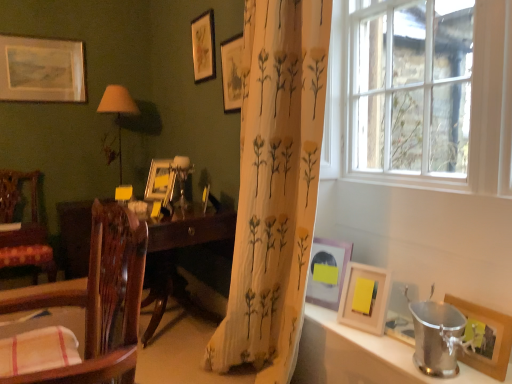
Describe the element at coordinates (360, 356) in the screenshot. Image resolution: width=512 pixels, height=384 pixels. I see `silver metallic bucket at lower right` at that location.

This screenshot has height=384, width=512. Describe the element at coordinates (176, 253) in the screenshot. I see `wooden desk at center` at that location.

This screenshot has height=384, width=512. What are the coordinates of `matte gold picture frame at center, arranged as the 6th picture frame when viewed from the right` in the screenshot? It's located at (160, 181).

You are a GUI agent. You are given a task and a screenshot of the screen. Output one action in this format:
    pyautogui.click(x=<x>, y=<y>)
    Task: Click on the matte gold picture frame at upper center, the 5th picture frame from the front
    This screenshot has width=512, height=384.
    Given the screenshot: What is the action you would take?
    pyautogui.click(x=203, y=47)

In order to face wooden chair at left, acting as the 2th chair starting from the left, should I rotate leftwards or rightwards?

To face it directly, rotate left by 24.334 degrees.

Image resolution: width=512 pixels, height=384 pixels. Identify the location of wooden chair with floral upholstery at left, positioned as the 1th chair in back-to-front order. (24, 227).

In terms of size, does matte wooden picture frame at upper center, the fourth picture frame viewed from the left, appear bigger or smaller than pink matte picture frame at lower right, the 3th picture frame in the right-to-left sequence?

Clearly, matte wooden picture frame at upper center, the fourth picture frame viewed from the left, is larger in size than pink matte picture frame at lower right, the 3th picture frame in the right-to-left sequence.

In the scene shown: Between matte wooden picture frame at upper center, the fourth picture frame viewed from the left, and pink matte picture frame at lower right, which ranks as the 3th picture frame in front-to-back order, which one appears on the left side from the viewer's perspective?

matte wooden picture frame at upper center, the fourth picture frame viewed from the left, is more to the left.

Looking at this image, from the image's perspective, which is above, matte wooden picture frame at upper center, which appears as the fourth picture frame when viewed from the right, or pink matte picture frame at lower right, arranged as the 5th picture frame when viewed from the back?

From the image's view, matte wooden picture frame at upper center, which appears as the fourth picture frame when viewed from the right, is above.

Does wooden chair at left, the 1th chair from the front, contain wooden chair with floral upholstery at left, positioned as the 1th chair in back-to-front order?

Definitely not — wooden chair with floral upholstery at left, positioned as the 1th chair in back-to-front order, is not inside wooden chair at left, the 1th chair from the front.

In the scene shown: Is wooden chair at left, arranged as the first chair when viewed from the right, positioned far away from wooden chair with floral upholstery at left, acting as the second chair starting from the front?

Yes, wooden chair at left, arranged as the first chair when viewed from the right, and wooden chair with floral upholstery at left, acting as the second chair starting from the front, are quite far apart.

From a real-world perspective, is wooden chair at left, arranged as the first chair when viewed from the right, physically located above or below wooden chair with floral upholstery at left, the second chair positioned from the right?

wooden chair at left, arranged as the first chair when viewed from the right, is above wooden chair with floral upholstery at left, the second chair positioned from the right.

Is wooden chair at left, the 1th chair from the front, to the right of wooden chair with floral upholstery at left, which is counted as the 1th chair, starting from the left, from the viewer's perspective?

Yes, wooden chair at left, the 1th chair from the front, is to the right of wooden chair with floral upholstery at left, which is counted as the 1th chair, starting from the left.

In the scene shown: From the image's perspective, is wooden chair with floral upholstery at left, the second chair positioned from the right, located above or below matte gold picture frame at center, arranged as the 6th picture frame when viewed from the right?

Based on their image positions, wooden chair with floral upholstery at left, the second chair positioned from the right, is located beneath matte gold picture frame at center, arranged as the 6th picture frame when viewed from the right.

Considering the sizes of wooden chair with floral upholstery at left, acting as the second chair starting from the front, and matte gold picture frame at center, arranged as the 6th picture frame when viewed from the right, in the image, is wooden chair with floral upholstery at left, acting as the second chair starting from the front, bigger or smaller than matte gold picture frame at center, arranged as the 6th picture frame when viewed from the right,?

Considering their sizes, wooden chair with floral upholstery at left, acting as the second chair starting from the front, takes up more space than matte gold picture frame at center, arranged as the 6th picture frame when viewed from the right.

How much distance is there between wooden chair with floral upholstery at left, positioned as the 1th chair in back-to-front order, and matte gold picture frame at center, which is the 2th picture frame in back-to-front order?

wooden chair with floral upholstery at left, positioned as the 1th chair in back-to-front order, is 35.74 inches from matte gold picture frame at center, which is the 2th picture frame in back-to-front order.

Is wooden chair with floral upholstery at left, acting as the second chair starting from the front, not near matte gold picture frame at center, marked as the 6th picture frame in a front-to-back arrangement?

No, wooden chair with floral upholstery at left, acting as the second chair starting from the front, is not far away from matte gold picture frame at center, marked as the 6th picture frame in a front-to-back arrangement.

Which object is further away from the camera, matte silver picture frame at upper left, which is the seventh picture frame from right to left, or clear glass window at right?

matte silver picture frame at upper left, which is the seventh picture frame from right to left, is more distant.

Considering the sizes of objects matte silver picture frame at upper left, which is the seventh picture frame from front to back, and clear glass window at right in the image provided, who is shorter, matte silver picture frame at upper left, which is the seventh picture frame from front to back, or clear glass window at right?

matte silver picture frame at upper left, which is the seventh picture frame from front to back, is shorter.

From a real-world perspective, which is physically above, matte silver picture frame at upper left, which is the seventh picture frame from right to left, or clear glass window at right?

matte silver picture frame at upper left, which is the seventh picture frame from right to left.

Which is correct: matte silver picture frame at upper left, the first picture frame in the left-to-right sequence, is inside clear glass window at right, or outside of it?

matte silver picture frame at upper left, the first picture frame in the left-to-right sequence, cannot be found inside clear glass window at right.

Is matte gold picture frame at upper center, which is the 3th picture frame from left to right, positioned with its back to wooden desk at center?

matte gold picture frame at upper center, which is the 3th picture frame from left to right, is not turned away from wooden desk at center.

Does point (206, 25) come in front of point (76, 209)?

Yes.

How different are the orientations of matte gold picture frame at upper center, acting as the 3th picture frame starting from the back, and wooden desk at center in degrees?

The angle between the facing direction of matte gold picture frame at upper center, acting as the 3th picture frame starting from the back, and the facing direction of wooden desk at center is 0.0133 degrees.

Is silver metallic bucket at lower right taller or shorter than wooden chair with floral upholstery at left, the second chair positioned from the right?

In the image, silver metallic bucket at lower right appears to be shorter than wooden chair with floral upholstery at left, the second chair positioned from the right.

The width and height of the screenshot is (512, 384). Identify the location of chair that is the 1st one above the silver metallic bucket at lower right (from a real-world perspective). (24, 227).

Does silver metallic bucket at lower right have a lesser width compared to wooden chair with floral upholstery at left, acting as the second chair starting from the front?

Correct, the width of silver metallic bucket at lower right is less than that of wooden chair with floral upholstery at left, acting as the second chair starting from the front.

Is silver metallic bucket at lower right not within wooden chair with floral upholstery at left, the second chair positioned from the right?

That's correct, silver metallic bucket at lower right is outside of wooden chair with floral upholstery at left, the second chair positioned from the right.

Considering their positions, is wooden picture frame at right, the 1th picture frame from the right, located in front of or behind silver metallic bucket at lower right?

Visually, wooden picture frame at right, the 1th picture frame from the right, is located behind silver metallic bucket at lower right.

From a real-world perspective, is wooden picture frame at right, marked as the seventh picture frame in a back-to-front arrangement, positioned above or below silver metallic bucket at lower right?

wooden picture frame at right, marked as the seventh picture frame in a back-to-front arrangement, is situated higher than silver metallic bucket at lower right in the real world.

Is wooden picture frame at right, the first picture frame when ordered from front to back, positioned with its back to silver metallic bucket at lower right?

No, wooden picture frame at right, the first picture frame when ordered from front to back, is not facing away from silver metallic bucket at lower right.

Is wooden picture frame at right, marked as the seventh picture frame in a back-to-front arrangement, outside of silver metallic bucket at lower right?

Yes, wooden picture frame at right, marked as the seventh picture frame in a back-to-front arrangement, is outside of silver metallic bucket at lower right.

This screenshot has width=512, height=384. What are the coordinates of `the 1st picture frame to the right when counting from the matte wooden picture frame at upper center, the fourth picture frame positioned from the back` in the screenshot? It's located at (331, 266).

Locate an element on the screen. The image size is (512, 384). chair on the left side of wooden chair at left, the 2th chair viewed from the back is located at coordinates (24, 227).

Based on their spatial positions, is wooden picture frame at lower right, positioned as the second picture frame in front-to-back order, or matte gold picture frame at center, marked as the 6th picture frame in a front-to-back arrangement, closer to pink matte picture frame at lower right, the 3th picture frame in the right-to-left sequence?

wooden picture frame at lower right, positioned as the second picture frame in front-to-back order, lies closer to pink matte picture frame at lower right, the 3th picture frame in the right-to-left sequence, than the other object.

Looking at the image, which one is located closer to wooden chair with floral upholstery at left, which is counted as the 1th chair, starting from the left, pink matte picture frame at lower right, the 3th picture frame in the right-to-left sequence, or clear glass window at right?

pink matte picture frame at lower right, the 3th picture frame in the right-to-left sequence.

Estimate the real-world distances between objects in this image. Which object is further from wooden chair at left, the 2th chair viewed from the back, wooden picture frame at right, the 1th picture frame from the right, or matte gold picture frame at upper center, which is the 5th picture frame from right to left?

matte gold picture frame at upper center, which is the 5th picture frame from right to left.

Estimate the real-world distances between objects in this image. Which object is closer to matte gold picture frame at upper center, acting as the 3th picture frame starting from the back, matte silver picture frame at upper left, the first picture frame in the back-to-front sequence, or wooden picture frame at lower right, positioned as the second picture frame in front-to-back order?

Among the two, matte silver picture frame at upper left, the first picture frame in the back-to-front sequence, is located nearer to matte gold picture frame at upper center, acting as the 3th picture frame starting from the back.

From the image, which object appears to be farther from matte gold picture frame at center, marked as the 2th picture frame in a left-to-right arrangement, wooden picture frame at lower right, positioned as the second picture frame in front-to-back order, or wooden chair at left, the 1th chair from the front?

Among the two, wooden chair at left, the 1th chair from the front, is located further to matte gold picture frame at center, marked as the 2th picture frame in a left-to-right arrangement.

When comparing their distances from translucent floral-patterned curtain at center, does silver metallic bucket at lower right or wooden desk at center seem closer?

silver metallic bucket at lower right.

Which object lies nearer to the anchor point matte silver picture frame at upper left, the first picture frame in the left-to-right sequence, pink matte picture frame at lower right, which ranks as the 3th picture frame in front-to-back order, or silver metallic bucket at lower right?

pink matte picture frame at lower right, which ranks as the 3th picture frame in front-to-back order, lies closer to matte silver picture frame at upper left, the first picture frame in the left-to-right sequence, than the other object.

Based on their spatial positions, is matte silver picture frame at upper left, which is the seventh picture frame from front to back, or matte gold picture frame at upper center, which is the 3th picture frame from left to right, further from wooden chair at left, the 2th chair viewed from the back?

matte silver picture frame at upper left, which is the seventh picture frame from front to back, lies further to wooden chair at left, the 2th chair viewed from the back, than the other object.

Find the location of a particular element. This screenshot has height=384, width=512. desk situated between wooden chair with floral upholstery at left, positioned as the 1th chair in back-to-front order, and wooden picture frame at lower right, arranged as the sixth picture frame when viewed from the left, from left to right is located at coordinates (176, 253).

At what (x,y) coordinates should I click in order to perform the action: click on curtain between wooden chair at left, acting as the 2th chair starting from the left, and pink matte picture frame at lower right, the 5th picture frame when ordered from left to right, in the front-back direction. Please return your answer as a coordinate pair (x, y). The width and height of the screenshot is (512, 384). Looking at the image, I should click on (275, 186).

This screenshot has width=512, height=384. I want to click on picture frame situated between matte silver picture frame at upper left, which is the seventh picture frame from right to left, and matte gold picture frame at upper center, which is the 5th picture frame from right to left, from left to right, so click(x=160, y=181).

Locate an element on the screen. The width and height of the screenshot is (512, 384). curtain between matte wooden picture frame at upper center, the fourth picture frame viewed from the left, and silver metallic bucket at lower right vertically is located at coordinates (275, 186).